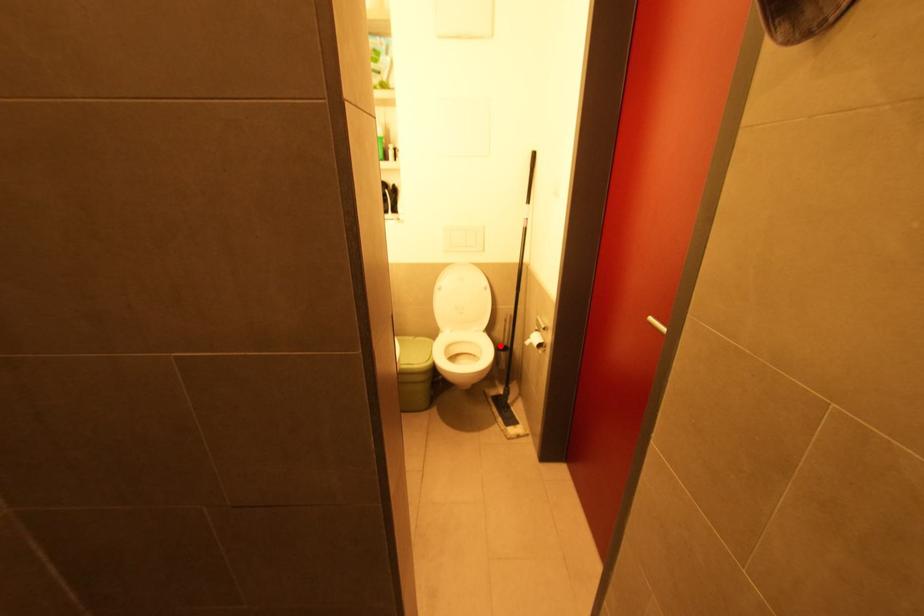
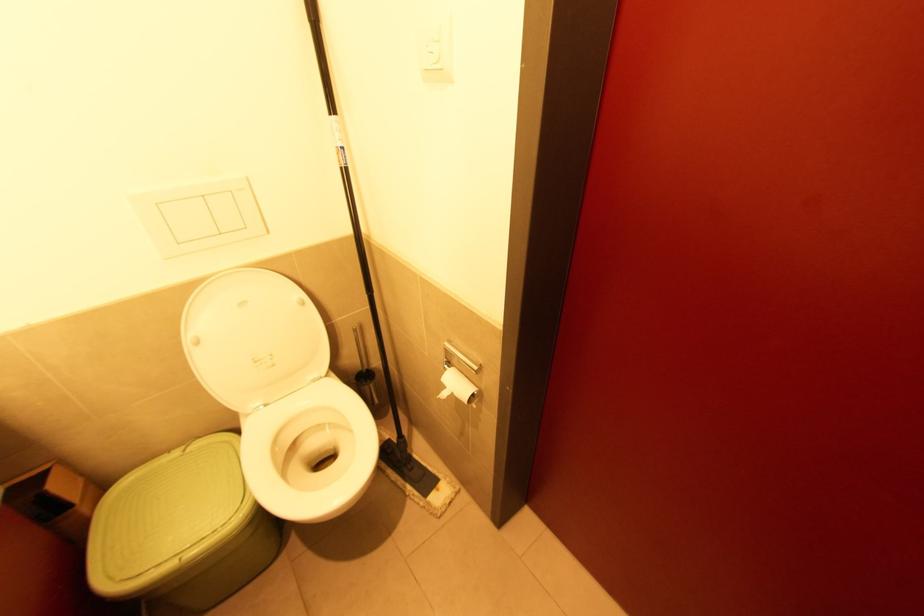
In the second image, find the point that corresponds to the highlighted location in the first image.

(358, 374)